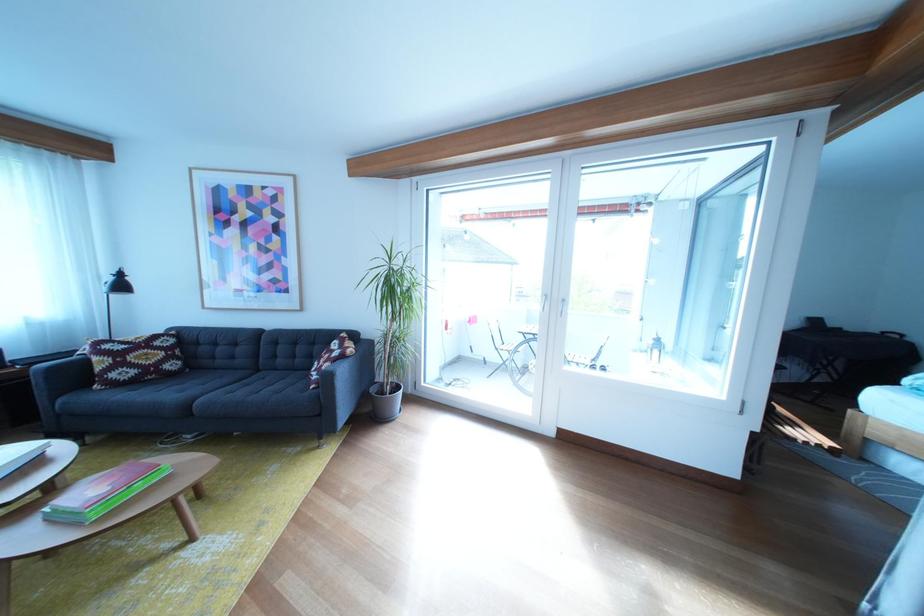
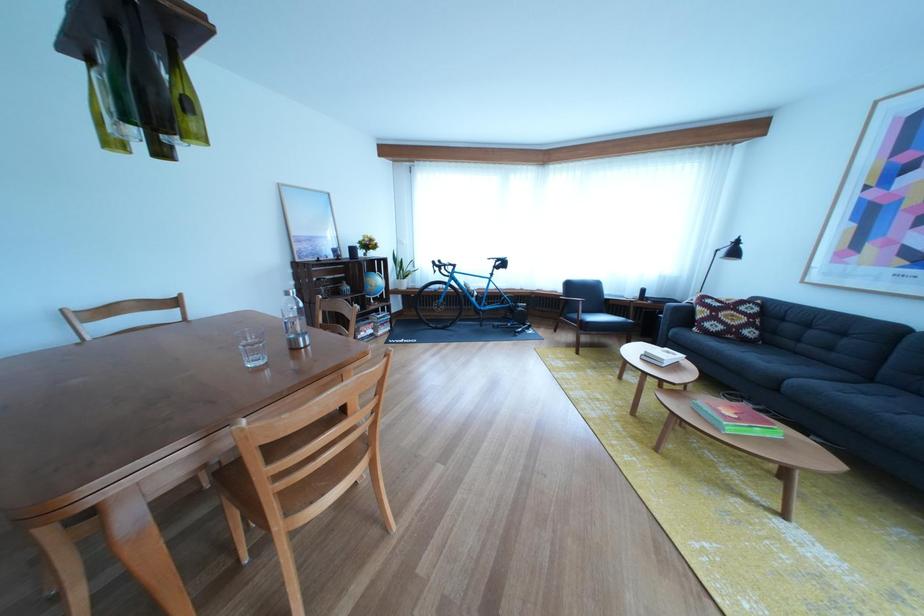
Question: The images are taken continuously from a first-person perspective. In which direction is your viewpoint rotating?

Choices:
 (A) Left
 (B) Right
 (C) Up
 (D) Down

Answer: (A)